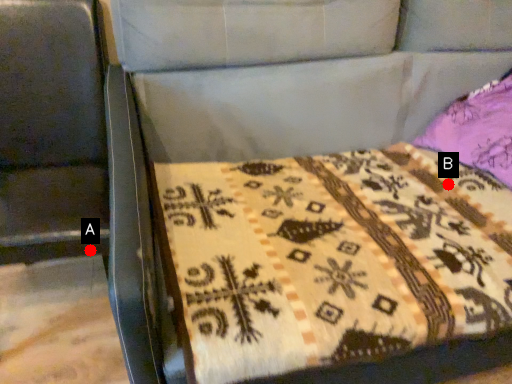
Question: Two points are circled on the image, labeled by A and B beside each circle. Among these points, which one is nearest to the camera?

Choices:
 (A) A is closer
 (B) B is closer

Answer: (A)